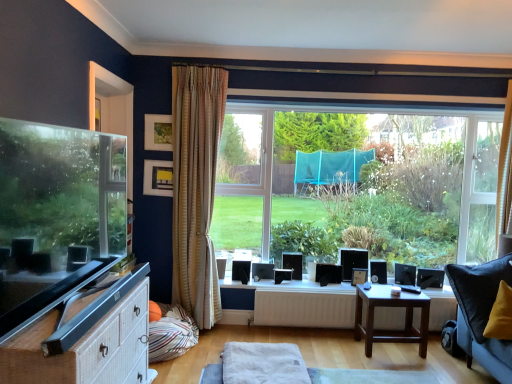
The height and width of the screenshot is (384, 512). What do you see at coordinates (170, 334) in the screenshot? I see `striped fabric pillow at lower left` at bounding box center [170, 334].

This screenshot has width=512, height=384. I want to click on striped fabric curtain at center, positioned as the first curtain in left-to-right order, so click(196, 187).

This screenshot has width=512, height=384. What do you see at coordinates (196, 187) in the screenshot?
I see `striped fabric curtain at center, positioned as the first curtain in left-to-right order` at bounding box center [196, 187].

Looking at this image, what is the approximate height of white matte radiator at center?

The height of white matte radiator at center is 12.33 inches.

Image resolution: width=512 pixels, height=384 pixels. What do you see at coordinates (504, 172) in the screenshot?
I see `white striped curtain at upper right, which is the 1th curtain from right to left` at bounding box center [504, 172].

How much space does white striped curtain at upper right, which is the 1th curtain from right to left, occupy horizontally?

white striped curtain at upper right, which is the 1th curtain from right to left, is 9.87 inches wide.

The width and height of the screenshot is (512, 384). I want to click on striped fabric pillow at lower left, so [x=170, y=334].

What's the angular difference between wooden picture frame at upper center, the third picture frame when ordered from right to left, and white matte radiator at center's facing directions?

There is a 3.89-degree angle between the facing directions of wooden picture frame at upper center, the third picture frame when ordered from right to left, and white matte radiator at center.

Considering the sizes of wooden picture frame at upper center, the third picture frame when ordered from right to left, and white matte radiator at center in the image, is wooden picture frame at upper center, the third picture frame when ordered from right to left, taller or shorter than white matte radiator at center?

Clearly, wooden picture frame at upper center, the third picture frame when ordered from right to left, is taller compared to white matte radiator at center.

Is wooden picture frame at upper center, the 3th picture frame from the back, completely or partially outside of white matte radiator at center?

Yes, wooden picture frame at upper center, the 3th picture frame from the back, is not within white matte radiator at center.

In the scene shown: From the image's perspective, relative to white matte radiator at center, is wooden picture frame at upper center, which ranks as the third picture frame in bottom-to-top order, above or below?

wooden picture frame at upper center, which ranks as the third picture frame in bottom-to-top order, is situated higher than white matte radiator at center in the image.

Looking at this image, who is smaller, striped fabric pillow at lower left or white striped curtain at upper right, the second curtain positioned from the left?

white striped curtain at upper right, the second curtain positioned from the left, is smaller.

Where is `curtain that is the 2nd object located behind the striped fabric pillow at lower left`? curtain that is the 2nd object located behind the striped fabric pillow at lower left is located at coordinates (504, 172).

Is striped fabric pillow at lower left turned away from white striped curtain at upper right, the second curtain positioned from the left?

No, striped fabric pillow at lower left is not facing the opposite direction of white striped curtain at upper right, the second curtain positioned from the left.

From their relative heights in the image, would you say striped fabric pillow at lower left is taller or shorter than white striped curtain at upper right, which is the 1th curtain from right to left?

Considering their sizes, striped fabric pillow at lower left has less height than white striped curtain at upper right, which is the 1th curtain from right to left.

Can you tell me how much black plastic speaker at lower right and matte black tv at left differ in facing direction?

There is a 94.9-degree angle between the facing directions of black plastic speaker at lower right and matte black tv at left.

Which object is positioned more to the left, black plastic speaker at lower right or matte black tv at left?

Positioned to the left is matte black tv at left.

Looking at their sizes, would you say black plastic speaker at lower right is wider or thinner than matte black tv at left?

In the image, black plastic speaker at lower right appears to be wider than matte black tv at left.

In terms of height, does black plastic speaker at lower right look taller or shorter compared to matte black tv at left?

Clearly, black plastic speaker at lower right is shorter compared to matte black tv at left.

Is striped fabric pillow at lower left wider or thinner than matte yellow picture frame at upper left, the 2th picture frame in the front-to-back sequence?

striped fabric pillow at lower left is wider than matte yellow picture frame at upper left, the 2th picture frame in the front-to-back sequence.

Would you say striped fabric pillow at lower left is to the left or to the right of matte yellow picture frame at upper left, which is the second picture frame in right-to-left order, in the picture?

striped fabric pillow at lower left is positioned on matte yellow picture frame at upper left, which is the second picture frame in right-to-left order,'s right side.

Is matte yellow picture frame at upper left, positioned as the 2th picture frame in left-to-right order, located within striped fabric pillow at lower left?

No, matte yellow picture frame at upper left, positioned as the 2th picture frame in left-to-right order, is not surrounded by striped fabric pillow at lower left.

Is striped fabric pillow at lower left positioned with its back to matte yellow picture frame at upper left, positioned as the 2th picture frame in left-to-right order?

No, striped fabric pillow at lower left is not facing away from matte yellow picture frame at upper left, positioned as the 2th picture frame in left-to-right order.

Does brown wooden table at lower right have a lesser width compared to white soft towel at center?

Correct, the width of brown wooden table at lower right is less than that of white soft towel at center.

Can you confirm if brown wooden table at lower right is smaller than white soft towel at center?

Actually, brown wooden table at lower right might be larger than white soft towel at center.

From a real-world perspective, between brown wooden table at lower right and white soft towel at center, who is vertically higher?

From a 3D spatial view, brown wooden table at lower right is above.

Is white striped curtain at upper right, the second curtain positioned from the left, taller or shorter than matte yellow picture frame at upper left, marked as the 2th picture frame in a bottom-to-top arrangement?

Clearly, white striped curtain at upper right, the second curtain positioned from the left, is taller compared to matte yellow picture frame at upper left, marked as the 2th picture frame in a bottom-to-top arrangement.

From the image's perspective, is white striped curtain at upper right, which is the 1th curtain from right to left, on matte yellow picture frame at upper left, the 2th picture frame in the front-to-back sequence?

Yes, from the image's perspective, white striped curtain at upper right, which is the 1th curtain from right to left, is on top of matte yellow picture frame at upper left, the 2th picture frame in the front-to-back sequence.

How many degrees apart are the facing directions of white striped curtain at upper right, the second curtain positioned from the left, and matte yellow picture frame at upper left, marked as the 2th picture frame in a bottom-to-top arrangement?

The angular difference between white striped curtain at upper right, the second curtain positioned from the left, and matte yellow picture frame at upper left, marked as the 2th picture frame in a bottom-to-top arrangement, is 0.777 degrees.

Is white striped curtain at upper right, which is the 1th curtain from right to left, at the right side of matte yellow picture frame at upper left, positioned as the 2th picture frame in top-to-bottom order?

Indeed, white striped curtain at upper right, which is the 1th curtain from right to left, is positioned on the right side of matte yellow picture frame at upper left, positioned as the 2th picture frame in top-to-bottom order.

Identify the location of pillow located below the black plastic speaker at lower right (from the image's perspective). This screenshot has width=512, height=384. (170, 334).

Considering the sizes of objects striped fabric pillow at lower left and black plastic speaker at lower right in the image provided, who is taller, striped fabric pillow at lower left or black plastic speaker at lower right?

With more height is striped fabric pillow at lower left.

Which is behind, striped fabric pillow at lower left or black plastic speaker at lower right?

black plastic speaker at lower right is more distant.

Based on the photo, from a real-world perspective, is striped fabric pillow at lower left below black plastic speaker at lower right?

Yes, from a real-world perspective, striped fabric pillow at lower left is below black plastic speaker at lower right.

You are a GUI agent. You are given a task and a screenshot of the screen. Output one action in this format:
    pyautogui.click(x=<x>, y=<y>)
    Task: Click on the 3rd picture frame above the white matte radiator at center (from the image's perspective)
    This screenshot has height=384, width=512.
    Given the screenshot: What is the action you would take?
    pyautogui.click(x=158, y=132)

This screenshot has width=512, height=384. In order to click on pillow below the white striped curtain at upper right, which is the 1th curtain from right to left (from a real-world perspective) in this screenshot , I will do `click(170, 334)`.

Looking at the image, which one is located closer to striped fabric pillow at lower left, matte black tv at left or matte yellow picture frame at upper left, positioned as the 2th picture frame in left-to-right order?

matte yellow picture frame at upper left, positioned as the 2th picture frame in left-to-right order, is closer to striped fabric pillow at lower left.

Estimate the real-world distances between objects in this image. Which object is closer to white striped curtain at upper right, the second curtain positioned from the left, matte black tv at left or transparent glass window at center?

transparent glass window at center is positioned closer to the anchor white striped curtain at upper right, the second curtain positioned from the left.

Based on their spatial positions, is matte black picture frame at upper center, acting as the third picture frame starting from the front, or matte black tv at left further from black plastic speaker at lower right?

matte black tv at left lies further to black plastic speaker at lower right than the other object.

Looking at the image, which one is located further to matte black picture frame at upper center, acting as the third picture frame starting from the front, matte yellow picture frame at upper left, the 2th picture frame in the front-to-back sequence, or transparent glass window at center?

Among the two, matte yellow picture frame at upper left, the 2th picture frame in the front-to-back sequence, is located further to matte black picture frame at upper center, acting as the third picture frame starting from the front.

Based on their spatial positions, is white matte radiator at center or black plastic speaker at lower right further from striped fabric pillow at lower left?

Among the two, black plastic speaker at lower right is located further to striped fabric pillow at lower left.

Considering their positions, is striped fabric curtain at center, positioned as the first curtain in left-to-right order, positioned closer to matte black tv at left than black plastic speaker at lower right?

The object closer to matte black tv at left is striped fabric curtain at center, positioned as the first curtain in left-to-right order.

Looking at the image, which one is located closer to white soft towel at center, matte black tv at left or white wicker cabinet at lower left?

white wicker cabinet at lower left lies closer to white soft towel at center than the other object.

Considering their positions, is matte yellow picture frame at upper left, the 2th picture frame in the front-to-back sequence, positioned further to white soft towel at center than white striped curtain at upper right, the second curtain positioned from the left?

Among the two, white striped curtain at upper right, the second curtain positioned from the left, is located further to white soft towel at center.

Image resolution: width=512 pixels, height=384 pixels. What are the coordinates of `plain between matte yellow picture frame at upper left, marked as the second picture frame in a back-to-front arrangement, and transparent glass window at center` in the screenshot? It's located at (263, 364).

I want to click on radiator between transparent glass window at center and white soft towel at center vertically, so click(x=305, y=308).

The width and height of the screenshot is (512, 384). I want to click on picture frame between striped fabric pillow at lower left and black plastic speaker at lower right from left to right, so click(359, 276).

Identify the location of radiator between white wicker cabinet at lower left and white striped curtain at upper right, the second curtain positioned from the left. The image size is (512, 384). (305, 308).